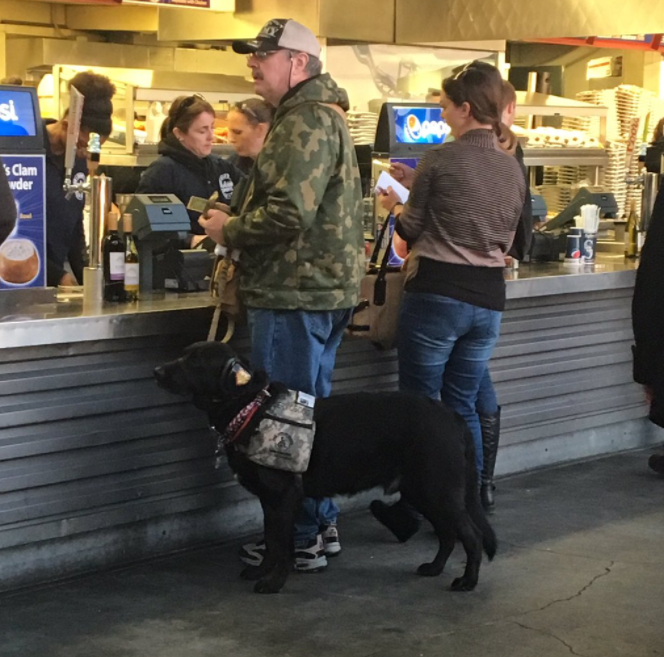
This screenshot has height=657, width=664. I want to click on floor, so click(396, 587).